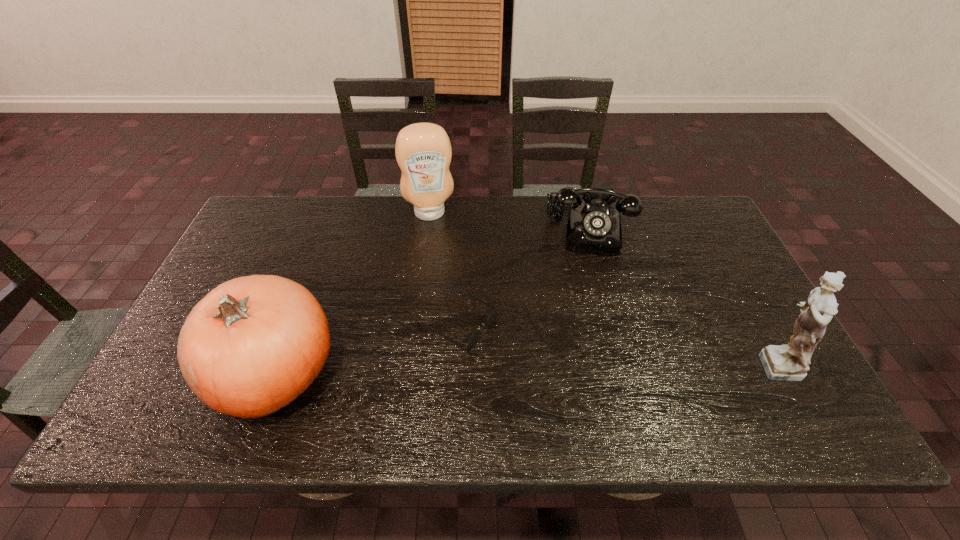
At what (x,y) coordinates should I click in order to perform the action: click on vacant space situated 0.400m on the label of the condiment. Please return your answer as a coordinate pair (x, y). This screenshot has width=960, height=540. Looking at the image, I should click on (447, 320).

You are a GUI agent. You are given a task and a screenshot of the screen. Output one action in this format:
    pyautogui.click(x=<x>, y=<y>)
    Task: Click on the free region located on the label of the condiment
    This screenshot has height=540, width=960.
    Given the screenshot: What is the action you would take?
    pyautogui.click(x=439, y=259)

The height and width of the screenshot is (540, 960). I want to click on vacant space situated on the label of the condiment, so click(446, 308).

The height and width of the screenshot is (540, 960). I want to click on free point located on the dial of the second object from right to left, so click(x=588, y=308).

Locate an element on the screen. The height and width of the screenshot is (540, 960). vacant space located on the dial of the second object from right to left is located at coordinates (588, 335).

Image resolution: width=960 pixels, height=540 pixels. I want to click on free region located on the dial of the second object from right to left, so click(x=588, y=286).

The image size is (960, 540). In order to click on vacant area located on the front-facing side of the sunglasses in this screenshot , I will do `click(563, 380)`.

Where is `vacant space located on the front-facing side of the sunglasses`? Image resolution: width=960 pixels, height=540 pixels. vacant space located on the front-facing side of the sunglasses is located at coordinates (543, 369).

You are a GUI agent. You are given a task and a screenshot of the screen. Output one action in this format:
    pyautogui.click(x=<x>, y=<y>)
    Task: Click on the blank space located 0.140m on the front-facing side of the sunglasses
    The image size is (960, 540).
    Given the screenshot: What is the action you would take?
    pyautogui.click(x=543, y=369)

Locate an element on the screen. condiment situated at the far edge is located at coordinates (423, 151).